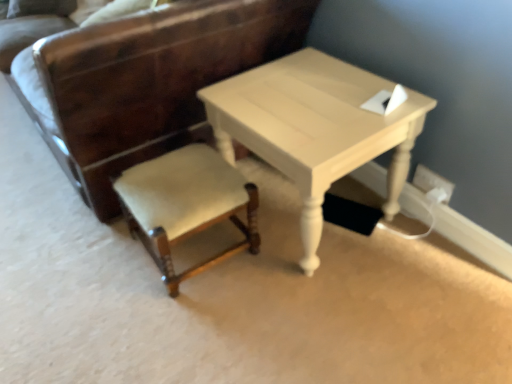
Question: Is velvet beige stool at center, which appears as the 1th chair when ordered from the bottom, further to camera compared to light beige wood table at center?

Choices:
 (A) yes
 (B) no

Answer: (A)

Question: From the image's perspective, does velvet beige stool at center, the 2th chair in the top-to-bottom sequence, appear lower than light beige wood table at center?

Choices:
 (A) no
 (B) yes

Answer: (B)

Question: From a real-world perspective, is velvet beige stool at center, which appears as the 1th chair when ordered from the bottom, physically above light beige wood table at center?

Choices:
 (A) no
 (B) yes

Answer: (A)

Question: Does velvet beige stool at center, which appears as the 1th chair when ordered from the bottom, have a lesser width compared to light beige wood table at center?

Choices:
 (A) yes
 (B) no

Answer: (A)

Question: Considering the relative positions of velvet beige stool at center, which appears as the 1th chair when ordered from the bottom, and light beige wood table at center in the image provided, is velvet beige stool at center, which appears as the 1th chair when ordered from the bottom, to the left of light beige wood table at center from the viewer's perspective?

Choices:
 (A) no
 (B) yes

Answer: (B)

Question: Looking at the image, does light beige wood table at center seem bigger or smaller compared to velvet beige chair at lower left, the 1th chair when ordered from top to bottom?

Choices:
 (A) small
 (B) big

Answer: (A)

Question: Is point (403, 137) positioned closer to the camera than point (79, 71)?

Choices:
 (A) farther
 (B) closer

Answer: (A)

Question: From the image's perspective, is light beige wood table at center located above or below velvet beige chair at lower left, the 2th chair positioned from the bottom?

Choices:
 (A) above
 (B) below

Answer: (B)

Question: In terms of height, does light beige wood table at center look taller or shorter compared to velvet beige chair at lower left, the 1th chair when ordered from top to bottom?

Choices:
 (A) tall
 (B) short

Answer: (B)

Question: From a real-world perspective, is velvet beige stool at center, which appears as the 1th chair when ordered from the bottom, physically located above or below velvet beige chair at lower left, the 2th chair positioned from the bottom?

Choices:
 (A) below
 (B) above

Answer: (A)

Question: Looking at their shapes, would you say velvet beige stool at center, which appears as the 1th chair when ordered from the bottom, is wider or thinner than velvet beige chair at lower left, the 1th chair when ordered from top to bottom?

Choices:
 (A) wide
 (B) thin

Answer: (B)

Question: Is point (146, 185) closer or farther from the camera than point (147, 61)?

Choices:
 (A) closer
 (B) farther

Answer: (B)

Question: From the image's perspective, is velvet beige stool at center, the 2th chair in the top-to-bottom sequence, located above or below velvet beige chair at lower left, the 1th chair when ordered from top to bottom?

Choices:
 (A) above
 (B) below

Answer: (B)

Question: In terms of height, does velvet beige chair at lower left, the 2th chair positioned from the bottom, look taller or shorter compared to white plastic electric outlet at lower right?

Choices:
 (A) short
 (B) tall

Answer: (B)

Question: From the image's perspective, is velvet beige chair at lower left, the 2th chair positioned from the bottom, located above or below white plastic electric outlet at lower right?

Choices:
 (A) below
 (B) above

Answer: (B)